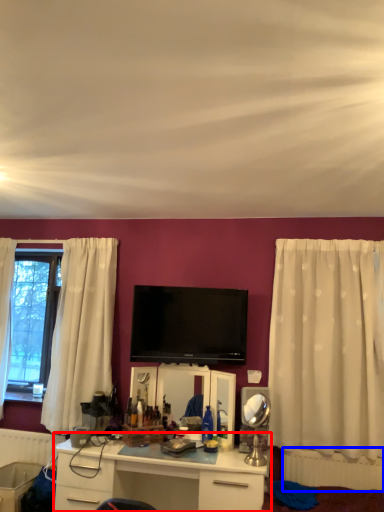
Question: Which object appears closest to the camera in this image, desk (highlighted by a red box) or radiator (highlighted by a blue box)?

Choices:
 (A) desk
 (B) radiator

Answer: (A)